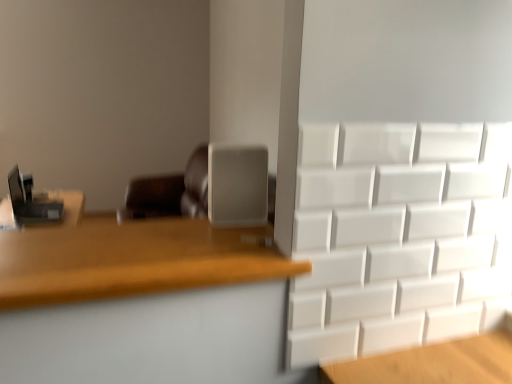
The height and width of the screenshot is (384, 512). What are the coordinates of `vacant space in front of matte gray speaker at center` in the screenshot? It's located at (227, 240).